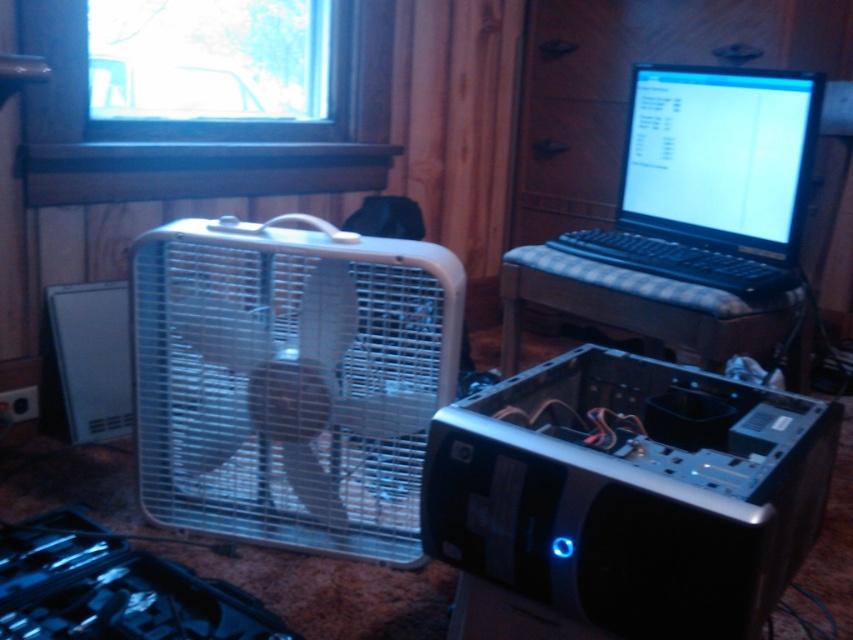
Is black plastic computer case at center thinner than plaid fabric keyboard at center?

Correct, black plastic computer case at center's width is less than plaid fabric keyboard at center's.

Does black plastic computer case at center appear under plaid fabric keyboard at center?

Yes.

At what (x,y) coordinates should I click in order to perform the action: click on black plastic computer case at center. Please return your answer as a coordinate pair (x, y). This screenshot has height=640, width=853. Looking at the image, I should click on (631, 492).

Does black plastic laptop at upper right appear on the right side of plaid fabric keyboard at center?

Correct, you'll find black plastic laptop at upper right to the right of plaid fabric keyboard at center.

Is point (641, 141) positioned before point (723, 301)?

No, it is not.

Locate an element on the screen. This screenshot has width=853, height=640. black plastic laptop at upper right is located at coordinates (711, 177).

Between metallic silver fan at left and black plastic computer case at center, which one appears on the right side from the viewer's perspective?

Positioned to the right is black plastic computer case at center.

Describe the element at coordinates (289, 380) in the screenshot. I see `metallic silver fan at left` at that location.

I want to click on metallic silver fan at left, so click(x=289, y=380).

Where is `metallic silver fan at left`? This screenshot has width=853, height=640. metallic silver fan at left is located at coordinates (289, 380).